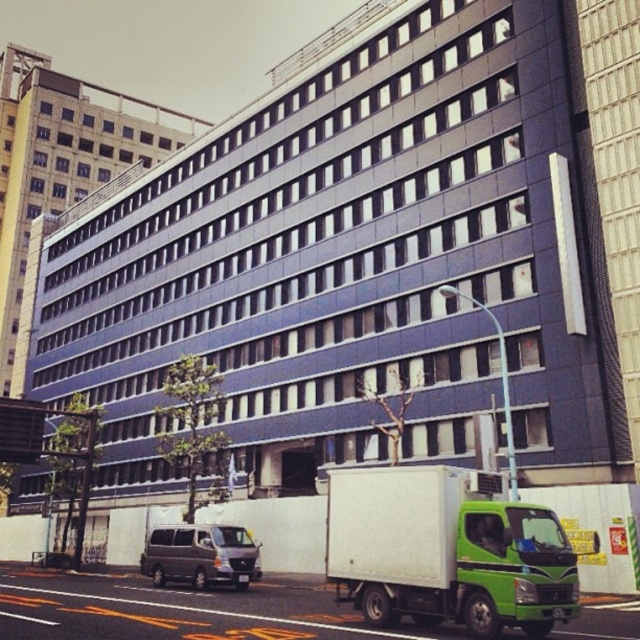
Looking at this image, is green matte truck at lower right below metallic gray van at lower left?

Actually, green matte truck at lower right is above metallic gray van at lower left.

Is point (342, 525) in front of point (241, 573)?

Yes, it is in front of point (241, 573).

Is point (460, 614) in front of point (252, 557)?

Yes.

You are a GUI agent. You are given a task and a screenshot of the screen. Output one action in this format:
    pyautogui.click(x=<x>, y=<y>)
    Task: Click on the green matte truck at lower right
    Image resolution: width=640 pixels, height=640 pixels.
    Given the screenshot: What is the action you would take?
    pyautogui.click(x=445, y=552)